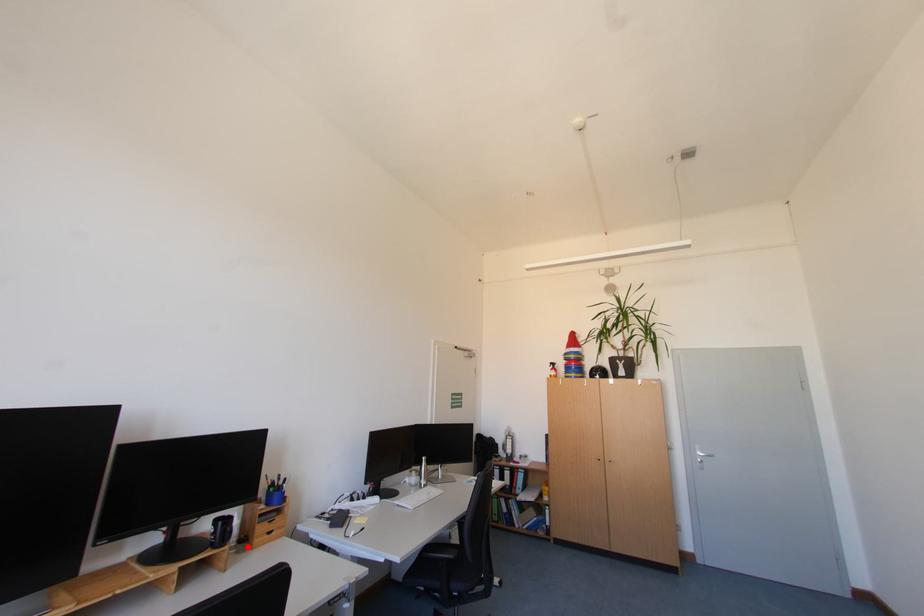
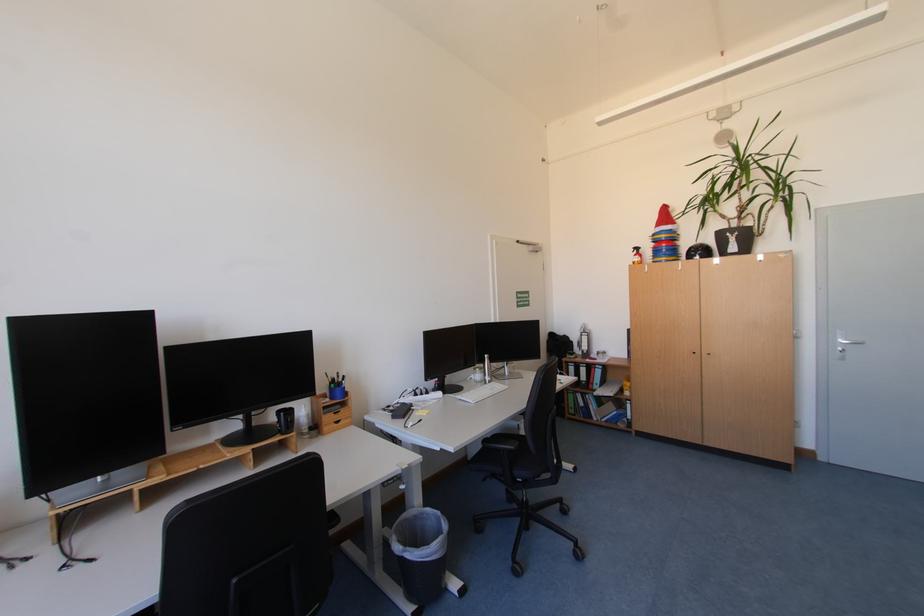
Question: I am providing you with two images of the same scene from different viewpoints. Image1 has a red point marked. In image2, the corresponding 3D location appears at what relative position? Reply with the corresponding letter.

Choices:
 (A) Closer
 (B) Farther

Answer: (B)